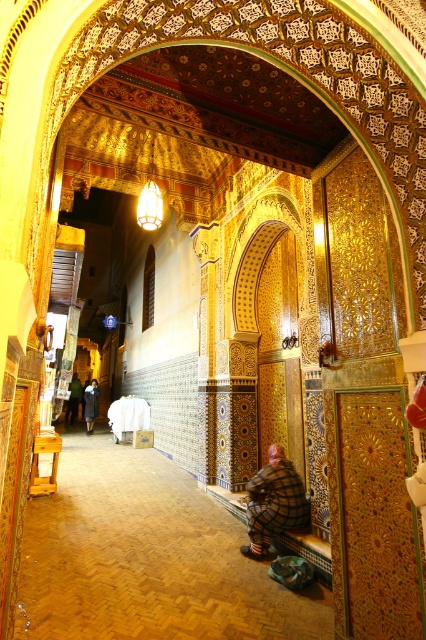
Question: Which object is farther from the camera taking this photo?

Choices:
 (A) plaid fabric person at lower center
 (B) dark gray wool coat at left
 (C) dark brown leather coat at center

Answer: (B)

Question: Is dark brown leather coat at center wider than dark gray wool coat at left?

Choices:
 (A) no
 (B) yes

Answer: (A)

Question: Considering the real-world distances, which object is closest to the plaid fabric person at lower center?

Choices:
 (A) dark brown leather coat at center
 (B) dark gray wool coat at left

Answer: (A)

Question: Observing the image, what is the correct spatial positioning of plaid fabric person at lower center in reference to dark gray wool coat at left?

Choices:
 (A) above
 (B) below

Answer: (A)

Question: Which point is closer to the camera?

Choices:
 (A) dark brown leather coat at center
 (B) plaid fabric person at lower center
 (C) dark gray wool coat at left

Answer: (B)

Question: In this image, where is plaid fabric person at lower center located relative to dark gray wool coat at left?

Choices:
 (A) below
 (B) above

Answer: (B)